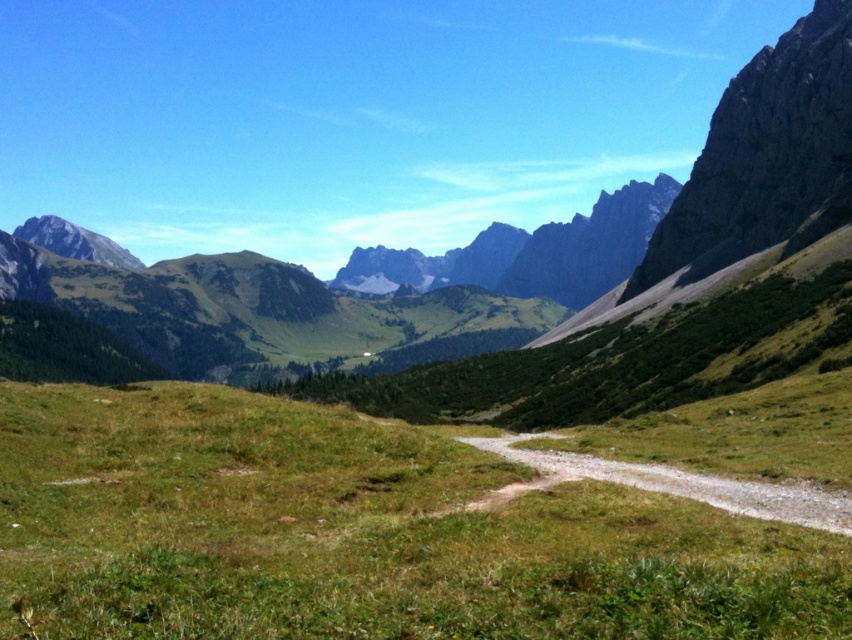
Question: Which of the following is the closest to the observer?

Choices:
 (A) (122, 458)
 (B) (707, 492)

Answer: (B)

Question: Can you confirm if green grassy at center is bigger than dirt/gravel trail at center?

Choices:
 (A) no
 (B) yes

Answer: (B)

Question: In this image, where is green grassy at center located relative to dirt/gravel trail at center?

Choices:
 (A) below
 (B) above

Answer: (B)

Question: Is green grassy at center closer to camera compared to dirt/gravel trail at center?

Choices:
 (A) no
 (B) yes

Answer: (B)

Question: Which point appears farthest from the camera in this image?

Choices:
 (A) (839, 512)
 (B) (442, 518)

Answer: (A)